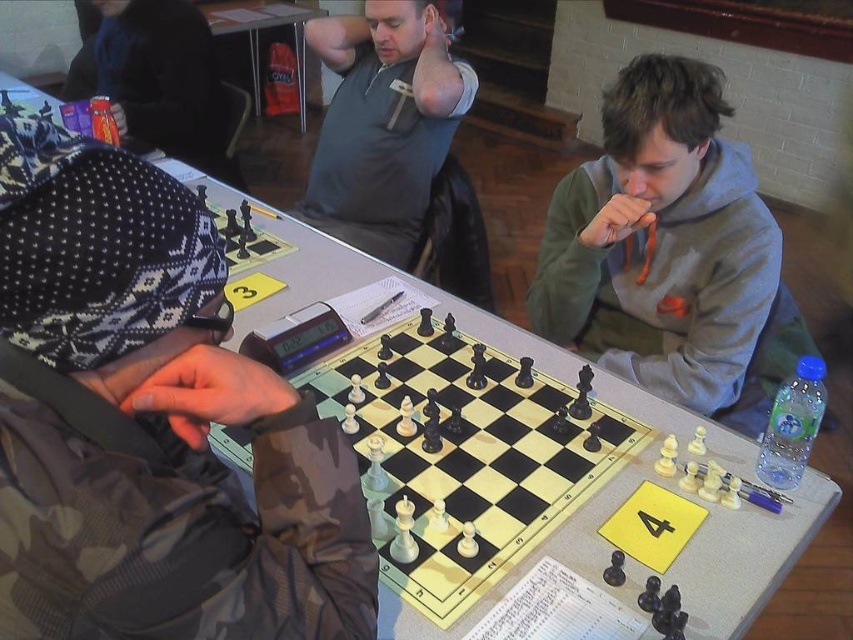
What is the exact coordinate of the camo fabric jacket at left?

The camo fabric jacket at left is located at coordinate point (x=149, y=424).

You are standing at the chessboard table marked with the number 4. You want to place a camo fabric jacket somewhere on the table. Is the point at coordinates point (x=149, y=424) on the table a suitable location for placing the camo fabric jacket?

The camo fabric jacket at left is located at point (x=149, y=424), so yes, the point at coordinates point (x=149, y=424) on the table is a suitable location for placing the camo fabric jacket.

You are a photographer at the chess tournament and need to capture a photo of both the camo fabric jacket at left and the gray matte shirt at center. Which clothing item appears smaller in the photo?

The camo fabric jacket at left appears smaller in the photo because it has a smaller size compared to the gray matte shirt at center.